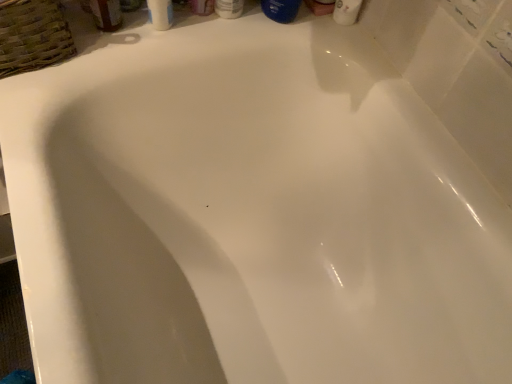
Where is `free space to the right of white glossy bottle at upper center, the 1th toiletry in the right-to-left sequence`? free space to the right of white glossy bottle at upper center, the 1th toiletry in the right-to-left sequence is located at coordinates (298, 27).